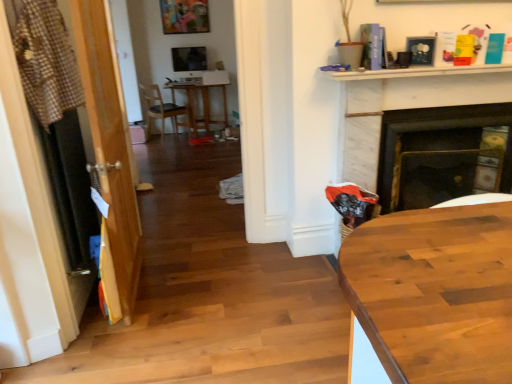
Where is `vacant region in front of wooden door at left`? vacant region in front of wooden door at left is located at coordinates (138, 339).